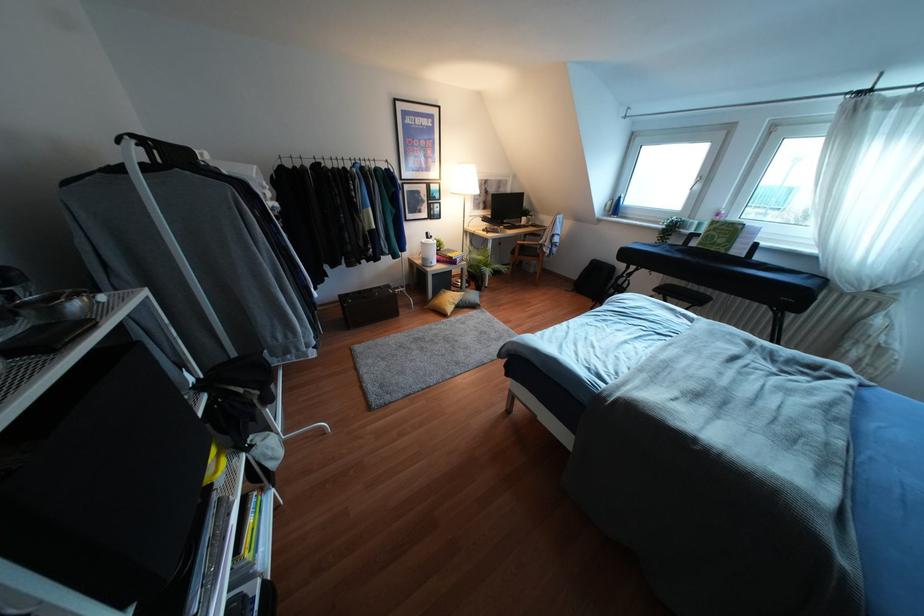
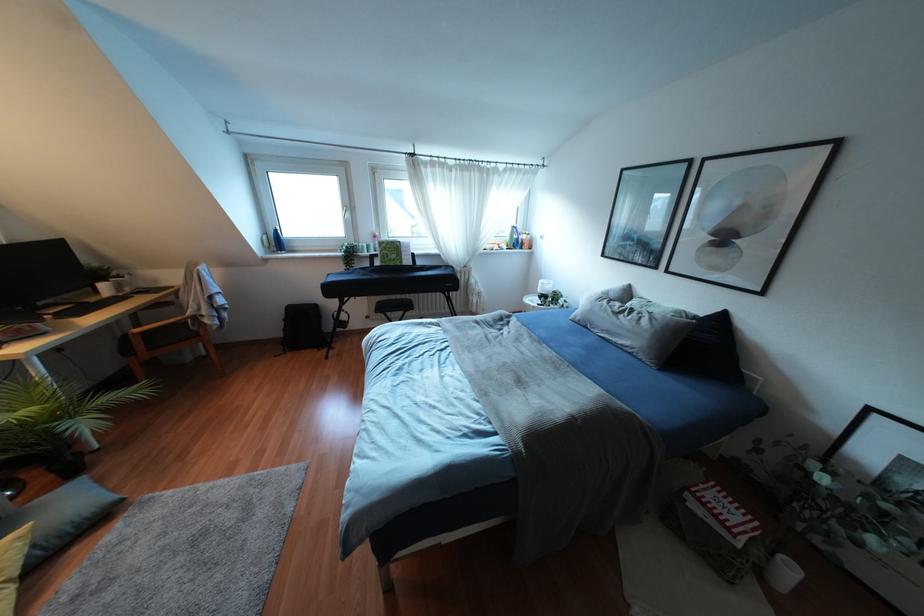
Question: Based on the continuous images, in which direction is the camera rotating? Reply with the corresponding letter.

Choices:
 (A) Left
 (B) Right
 (C) Up
 (D) Down

Answer: (B)